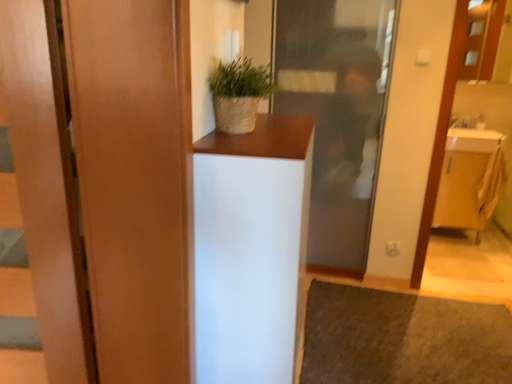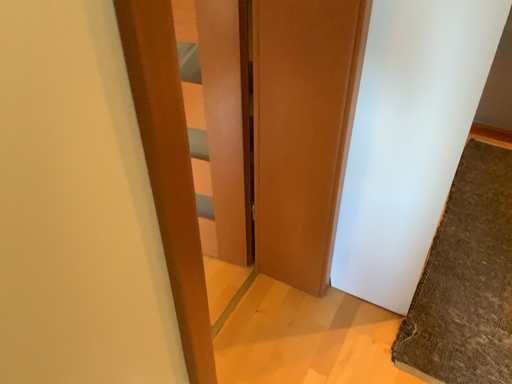
Question: How did the camera likely rotate when shooting the video?

Choices:
 (A) rotated upward
 (B) rotated downward

Answer: (B)